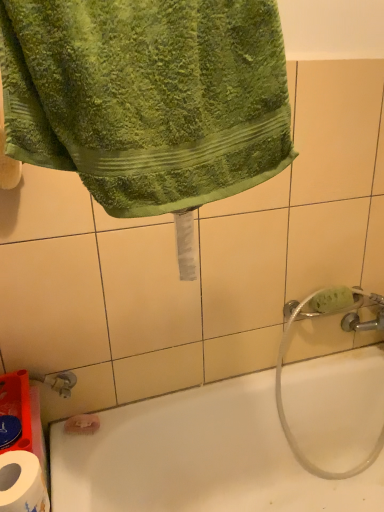
Question: Relative to white paper at lower left, is green terry cloth towel at upper left in front or behind?

Choices:
 (A) front
 (B) behind

Answer: (A)

Question: In the image, is green terry cloth towel at upper left on the left side or the right side of white paper at lower left?

Choices:
 (A) right
 (B) left

Answer: (A)

Question: Considering the real-world distances, which object is closest to the transparent rubber garden hose at lower right?

Choices:
 (A) white paper at lower left
 (B) white glossy bathtub at lower left
 (C) green sponge at right
 (D) green terry cloth towel at upper left

Answer: (B)

Question: Considering the real-world distances, which object is farthest from the green sponge at right?

Choices:
 (A) green terry cloth towel at upper left
 (B) white glossy bathtub at lower left
 (C) transparent rubber garden hose at lower right
 (D) white paper at lower left

Answer: (D)